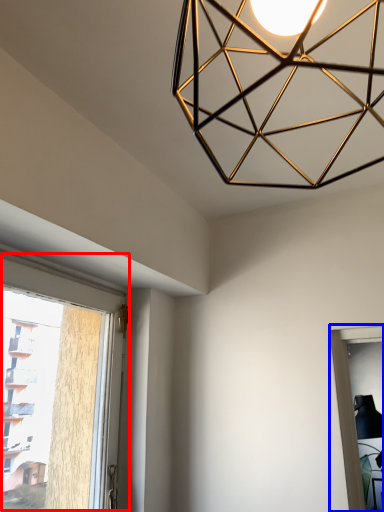
Question: Which object appears closest to the camera in this image, window (highlighted by a red box) or window (highlighted by a blue box)?

Choices:
 (A) window
 (B) window

Answer: (A)